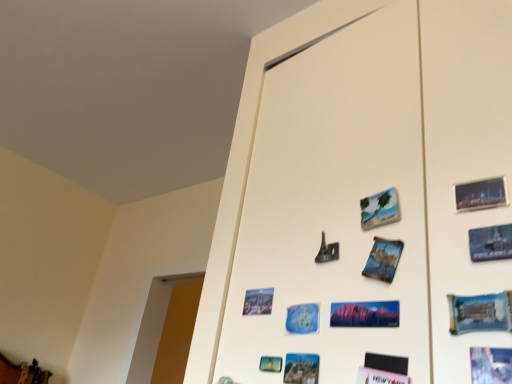
Question: Is blue paper postcard at lower right, the 8th postcard from the left, to the right of metallic silver eiffel tower at center from the viewer's perspective?

Choices:
 (A) yes
 (B) no

Answer: (A)

Question: Is blue paper postcard at lower right, the 8th postcard from the left, further to the viewer compared to metallic silver eiffel tower at center?

Choices:
 (A) yes
 (B) no

Answer: (B)

Question: Is blue paper postcard at lower right, the 8th postcard from the left, aimed at metallic silver eiffel tower at center?

Choices:
 (A) yes
 (B) no

Answer: (B)

Question: Considering the relative positions of blue paper postcard at lower right, positioned as the first postcard in right-to-left order, and metallic silver eiffel tower at center in the image provided, is blue paper postcard at lower right, positioned as the first postcard in right-to-left order, in front of metallic silver eiffel tower at center?

Choices:
 (A) yes
 (B) no

Answer: (A)

Question: Does blue paper postcard at lower right, the 8th postcard from the left, have a greater width compared to metallic silver eiffel tower at center?

Choices:
 (A) yes
 (B) no

Answer: (B)

Question: Can you confirm if blue paper postcard at lower right, positioned as the first postcard in right-to-left order, is smaller than metallic silver eiffel tower at center?

Choices:
 (A) yes
 (B) no

Answer: (A)

Question: Considering the relative sizes of blue paper postcard at center, acting as the 4th postcard starting from the right, and matte paper postcard at lower center, positioned as the eighth postcard in right-to-left order, in the image provided, is blue paper postcard at center, acting as the 4th postcard starting from the right, wider than matte paper postcard at lower center, positioned as the eighth postcard in right-to-left order,?

Choices:
 (A) yes
 (B) no

Answer: (A)

Question: From a real-world perspective, is blue paper postcard at center, acting as the 4th postcard starting from the right, over matte paper postcard at lower center, positioned as the eighth postcard in right-to-left order?

Choices:
 (A) no
 (B) yes

Answer: (B)

Question: From the image's perspective, is blue paper postcard at center, the fifth postcard positioned from the left, located beneath matte paper postcard at lower center, positioned as the eighth postcard in right-to-left order?

Choices:
 (A) yes
 (B) no

Answer: (B)

Question: From a real-world perspective, is blue paper postcard at center, the fifth postcard positioned from the left, below matte paper postcard at lower center, arranged as the 1th postcard when viewed from the left?

Choices:
 (A) yes
 (B) no

Answer: (B)

Question: Is blue paper postcard at center, acting as the 4th postcard starting from the right, positioned with its back to matte paper postcard at lower center, positioned as the eighth postcard in right-to-left order?

Choices:
 (A) no
 (B) yes

Answer: (A)

Question: Is blue paper postcard at center, the fifth postcard positioned from the left, not inside matte paper postcard at lower center, positioned as the eighth postcard in right-to-left order?

Choices:
 (A) no
 (B) yes

Answer: (B)

Question: Considering the relative sizes of blue paper postcard at lower center, placed as the 7th postcard when sorted from right to left, and metallic gold jewelry at lower left in the image provided, is blue paper postcard at lower center, placed as the 7th postcard when sorted from right to left, smaller than metallic gold jewelry at lower left?

Choices:
 (A) no
 (B) yes

Answer: (B)